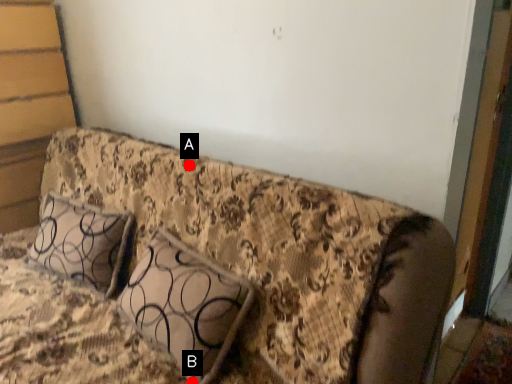
Question: Two points are circled on the image, labeled by A and B beside each circle. Among these points, which one is farthest from the camera?

Choices:
 (A) A is further
 (B) B is further

Answer: (A)